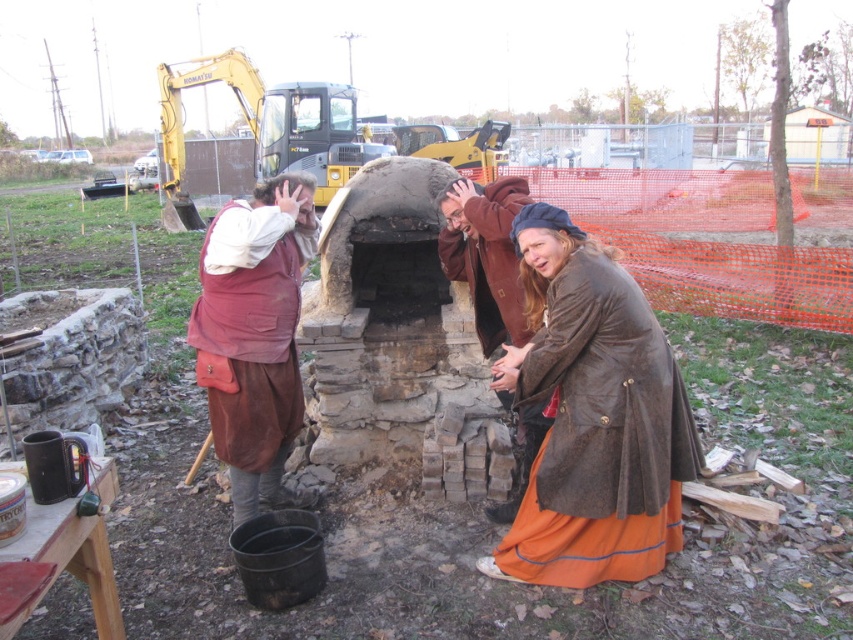
Question: Is brown suede coat at lower right further to the viewer compared to brown leather jacket at center?

Choices:
 (A) no
 (B) yes

Answer: (A)

Question: Can you confirm if brown suede coat at lower right is wider than brown suede vest at center?

Choices:
 (A) no
 (B) yes

Answer: (B)

Question: Which point is closer to the camera taking this photo?

Choices:
 (A) pos(224,323)
 (B) pos(440,211)
 (C) pos(566,512)

Answer: (C)

Question: Based on their relative distances, which object is nearer to the brown suede vest at center?

Choices:
 (A) brown leather jacket at center
 (B) brown suede coat at lower right

Answer: (A)

Question: Does brown suede vest at center appear over brown leather jacket at center?

Choices:
 (A) no
 (B) yes

Answer: (A)

Question: Which point appears closest to the camera in this image?

Choices:
 (A) (570, 545)
 (B) (509, 220)
 (C) (219, 316)

Answer: (A)